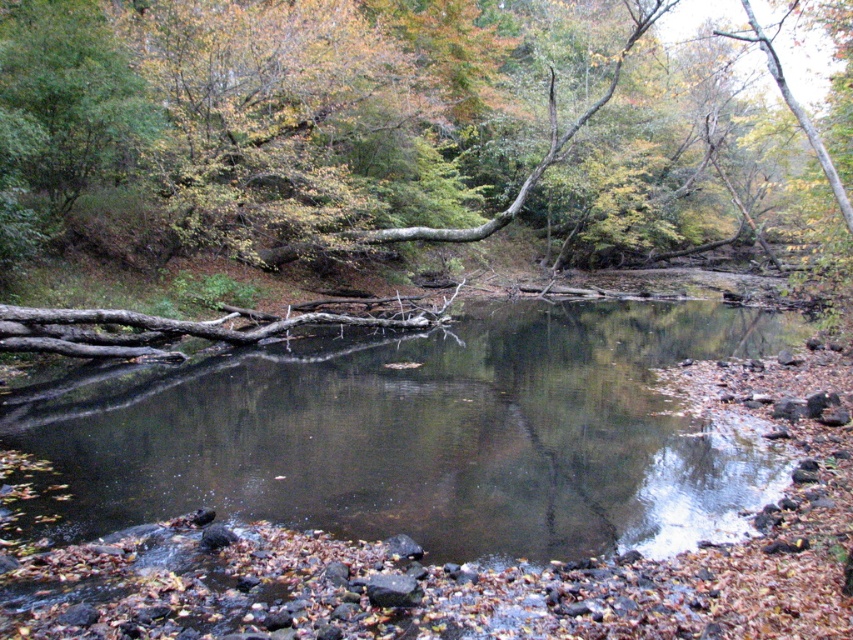
You are a photographer planning to capture the reflection of the smooth brown log at center in the smooth dark water at center. Based on the scene description, can you determine if the log will be fully reflected in the water?

The smooth brown log at center has a larger size compared to smooth dark water at center, so the log may not be fully reflected in the water due to its larger size exceeding the water surface area.

You are a frog attempting to jump from the smooth brown log at center to the smooth dark water at center. Can you safely land on the water? Explain your reasoning based on the scene details.

The smooth brown log at center might be wider than smooth dark water at center. However, frogs can jump onto water, so it is possible for the frog to safely land on the smooth dark water at center.